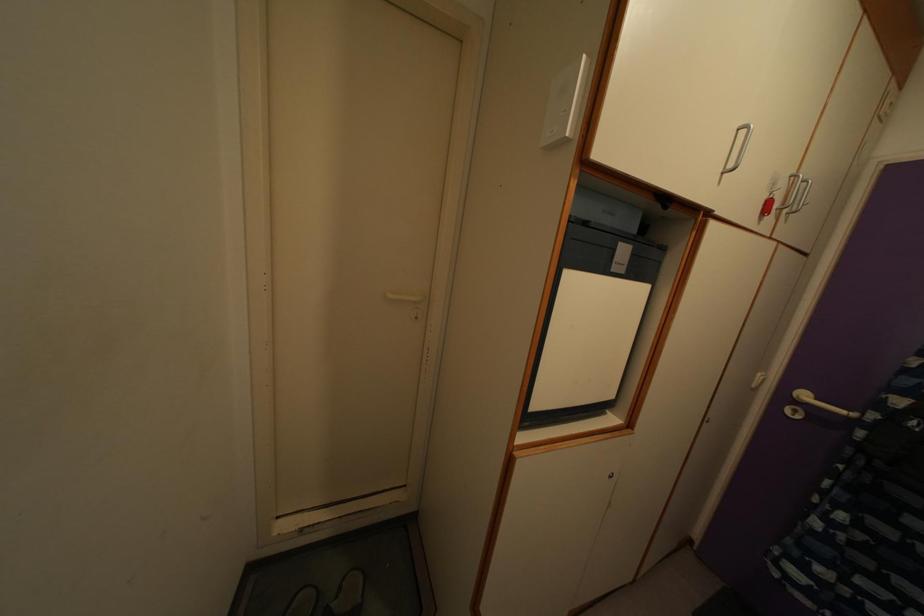
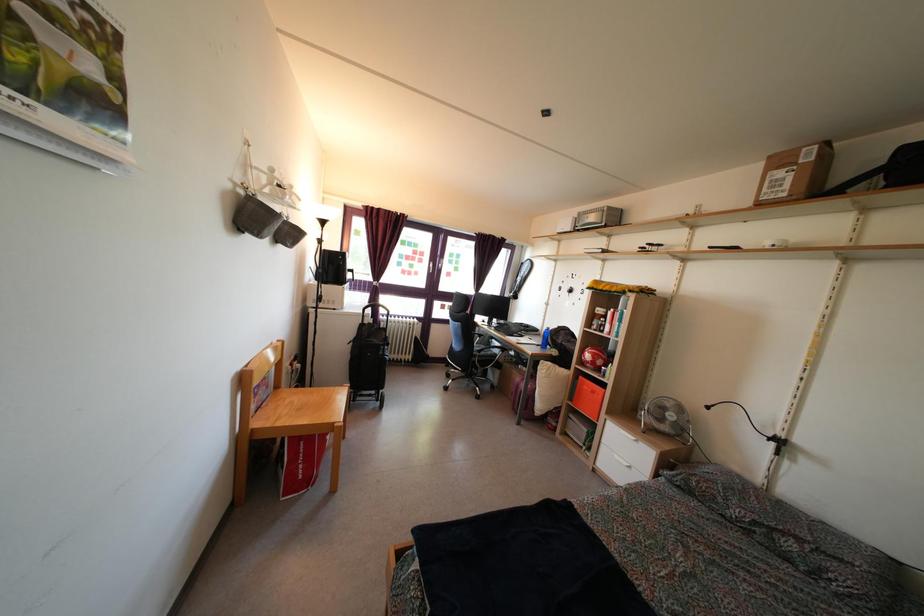
Question: The camera is either moving clockwise (left) or counter-clockwise (right) around the object. The first image is from the beginning of the video and the second image is from the end. Is the camera moving left or right when shooting the video?

Choices:
 (A) Left
 (B) Right

Answer: (B)